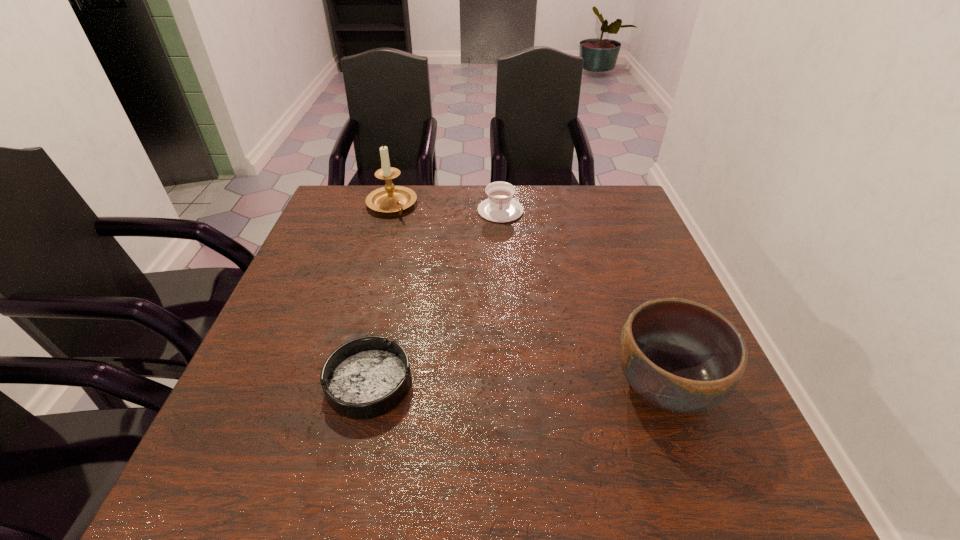
At what (x,y) coordinates should I click in order to perform the action: click on object located at the far left corner. Please return your answer as a coordinate pair (x, y). Image resolution: width=960 pixels, height=540 pixels. Looking at the image, I should click on (390, 198).

The height and width of the screenshot is (540, 960). Find the location of `object at the near right corner`. object at the near right corner is located at coordinates (681, 356).

This screenshot has height=540, width=960. Identify the location of vacant space at the far edge. (375, 228).

I want to click on vacant space at the near edge, so click(421, 404).

The height and width of the screenshot is (540, 960). Identify the location of free space at the left edge. (329, 303).

You are a GUI agent. You are given a task and a screenshot of the screen. Output one action in this format:
    pyautogui.click(x=<x>, y=<y>)
    Task: Click on the vacant space at the right edge of the desktop
    
    Given the screenshot: What is the action you would take?
    pyautogui.click(x=660, y=264)

Find the location of a particular element. free space at the far right corner of the desktop is located at coordinates (597, 211).

Locate an element on the screen. The image size is (960, 540). vacant space at the near right corner of the desktop is located at coordinates (719, 422).

This screenshot has height=540, width=960. In order to click on blank region between the tallest object and the shortest object in this screenshot , I will do `click(380, 294)`.

The height and width of the screenshot is (540, 960). Identify the location of vacant space in between the tallest object and the bowl. [528, 295].